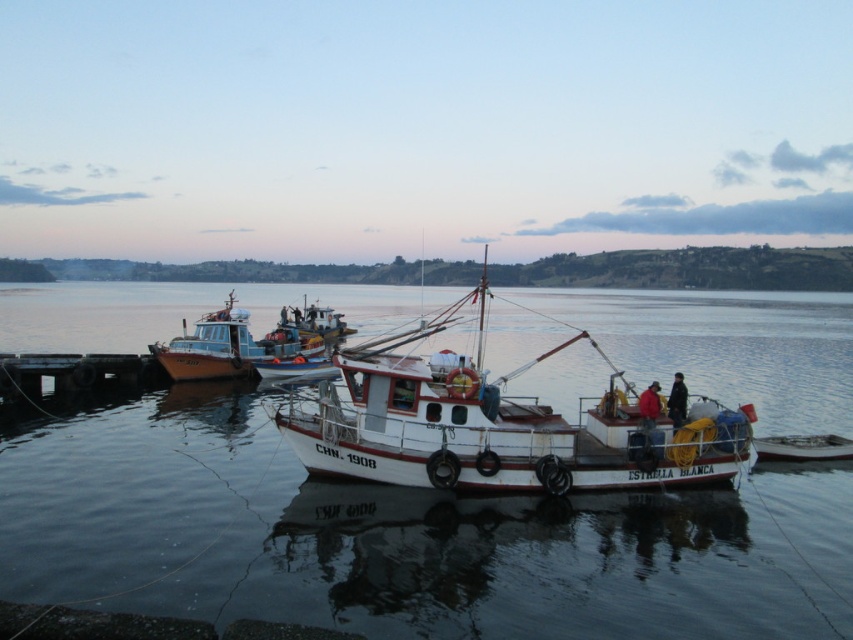
You are standing on the wooden pier and see both the black leather jacket at center and the red fabric jacket at center. Which jacket is closer to you?

The black leather jacket at center is closer to you because it is further to the viewer than the red fabric jacket at center.

You are an observer standing on the wooden pier next to the wooden boat at left. You want to walk towards the white glossy water at center. Which direction should you move in?

The white glossy water at center is to the right of the wooden boat at left, so you should move to your right to reach the white glossy water at center.